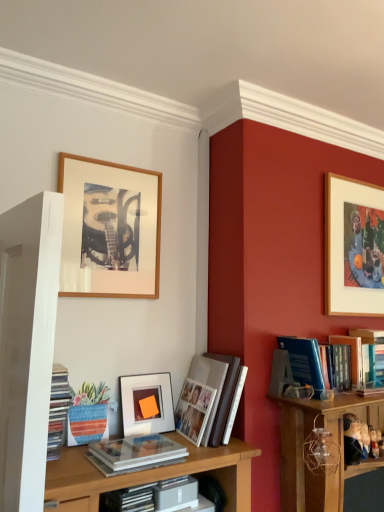
This screenshot has height=512, width=384. I want to click on wooden framed artwork at upper right, which ranks as the 3th picture frame in left-to-right order, so click(353, 247).

Describe the element at coordinates (210, 399) in the screenshot. I see `white paper photo album at center, acting as the 3th book starting from the left` at that location.

Image resolution: width=384 pixels, height=512 pixels. I want to click on blue hardcover book at upper right, positioned as the first book in right-to-left order, so click(371, 355).

This screenshot has height=512, width=384. What do you see at coordinates (305, 362) in the screenshot?
I see `blue hardcover book at center-right, which is the 2th book in right-to-left order` at bounding box center [305, 362].

Identify the location of wooden framed artwork at upper right, which is counted as the 1th picture frame, starting from the right. Image resolution: width=384 pixels, height=512 pixels. (353, 247).

Considering the points (291, 352) and (107, 465), which point is in front, point (291, 352) or point (107, 465)?

The point (107, 465) is closer.

Is blue hardcover book at center-right, which ranks as the fourth book in left-to-right order, taller than matte white book at center, which ranks as the 4th book in right-to-left order?

Indeed, blue hardcover book at center-right, which ranks as the fourth book in left-to-right order, has a greater height compared to matte white book at center, which ranks as the 4th book in right-to-left order.

Starting from the blue hardcover book at center-right, which ranks as the fourth book in left-to-right order, which book is the 2nd one to the left? Please provide its 2D coordinates.

[(137, 451)]

Is blue hardcover book at center-right, which is the 2th book in right-to-left order, far from matte white book at center, which ranks as the 4th book in right-to-left order?

No, there isn't a large distance between blue hardcover book at center-right, which is the 2th book in right-to-left order, and matte white book at center, which ranks as the 4th book in right-to-left order.

Is wooden framed artwork at upper right, which is counted as the 1th picture frame, starting from the right, inside or outside of gray matte book at center?

wooden framed artwork at upper right, which is counted as the 1th picture frame, starting from the right, cannot be found inside gray matte book at center.

Looking at this image, does wooden framed artwork at upper right, which is counted as the 1th picture frame, starting from the right, turn towards gray matte book at center?

No, wooden framed artwork at upper right, which is counted as the 1th picture frame, starting from the right, is not aimed at gray matte book at center.

How far apart are wooden framed artwork at upper right, which is counted as the 1th picture frame, starting from the right, and gray matte book at center?

wooden framed artwork at upper right, which is counted as the 1th picture frame, starting from the right, and gray matte book at center are 4.12 feet apart.

Is wooden framed artwork at upper right, which is counted as the 1th picture frame, starting from the right, wider or thinner than gray matte book at center?

wooden framed artwork at upper right, which is counted as the 1th picture frame, starting from the right, is thinner than gray matte book at center.

Considering their positions, is wooden frame at upper left, positioned as the first picture frame in left-to-right order, located in front of or behind matte glass picture frame at center, which appears as the 2th picture frame when viewed from the right?

wooden frame at upper left, positioned as the first picture frame in left-to-right order, is positioned closer to the viewer than matte glass picture frame at center, which appears as the 2th picture frame when viewed from the right.

From the picture: Considering the positions of objects wooden frame at upper left, positioned as the first picture frame in left-to-right order, and matte glass picture frame at center, which appears as the 2th picture frame when viewed from the right, in the image provided, who is more to the left, wooden frame at upper left, positioned as the first picture frame in left-to-right order, or matte glass picture frame at center, which appears as the 2th picture frame when viewed from the right,?

wooden frame at upper left, positioned as the first picture frame in left-to-right order.

Considering the points (77, 226) and (135, 410), which point is behind, point (77, 226) or point (135, 410)?

Point (135, 410)

Can you tell me how much wooden frame at upper left, positioned as the first picture frame in left-to-right order, and matte glass picture frame at center, marked as the second picture frame in a left-to-right arrangement, differ in facing direction?

The angular difference between wooden frame at upper left, positioned as the first picture frame in left-to-right order, and matte glass picture frame at center, marked as the second picture frame in a left-to-right arrangement, is 0.299 degrees.

Is point (356, 250) farther from camera compared to point (63, 400)?

Yes, it is behind point (63, 400).

From the wooden framed artwork at upper right, which ranks as the 3th picture frame in left-to-right order, count 4th books forward and point to it. Please provide its 2D coordinates.

[(58, 410)]

Considering the relative sizes of wooden framed artwork at upper right, which ranks as the 3th picture frame in left-to-right order, and matte plastic books at left, marked as the first book in a left-to-right arrangement, in the image provided, is wooden framed artwork at upper right, which ranks as the 3th picture frame in left-to-right order, taller than matte plastic books at left, marked as the first book in a left-to-right arrangement,?

Yes, wooden framed artwork at upper right, which ranks as the 3th picture frame in left-to-right order, is taller than matte plastic books at left, marked as the first book in a left-to-right arrangement.

From a real-world perspective, is wooden framed artwork at upper right, which is counted as the 1th picture frame, starting from the right, physically located above or below matte plastic books at left, which ranks as the fifth book in right-to-left order?

wooden framed artwork at upper right, which is counted as the 1th picture frame, starting from the right, is situated higher than matte plastic books at left, which ranks as the fifth book in right-to-left order, in the real world.

Is matte white book at center, which ranks as the 4th book in right-to-left order, far from white paper photo album at center, which is the third book from right to left?

matte white book at center, which ranks as the 4th book in right-to-left order, is near white paper photo album at center, which is the third book from right to left, not far away.

Measure the distance from matte white book at center, which ranks as the 4th book in right-to-left order, to white paper photo album at center, acting as the 3th book starting from the left.

matte white book at center, which ranks as the 4th book in right-to-left order, is 22.87 centimeters away from white paper photo album at center, acting as the 3th book starting from the left.

Relative to white paper photo album at center, acting as the 3th book starting from the left, is matte white book at center, the 2th book when ordered from left to right, in front or behind?

In the image, matte white book at center, the 2th book when ordered from left to right, appears in front of white paper photo album at center, acting as the 3th book starting from the left.

From the image's perspective, is matte white book at center, the 2th book when ordered from left to right, located beneath white paper photo album at center, acting as the 3th book starting from the left?

Yes, from the image's perspective, matte white book at center, the 2th book when ordered from left to right, is beneath white paper photo album at center, acting as the 3th book starting from the left.

Between wooden frame at upper left, the third picture frame in the right-to-left sequence, and matte plastic books at left, which ranks as the fifth book in right-to-left order, which one has larger width?

Wider between the two is matte plastic books at left, which ranks as the fifth book in right-to-left order.

Does wooden frame at upper left, positioned as the first picture frame in left-to-right order, have a smaller size compared to matte plastic books at left, which ranks as the fifth book in right-to-left order?

No, wooden frame at upper left, positioned as the first picture frame in left-to-right order, is not smaller than matte plastic books at left, which ranks as the fifth book in right-to-left order.

Where is `book on the left of wooden frame at upper left, positioned as the first picture frame in left-to-right order`? The height and width of the screenshot is (512, 384). book on the left of wooden frame at upper left, positioned as the first picture frame in left-to-right order is located at coordinates (58, 410).

Can you confirm if wooden frame at upper left, the third picture frame in the right-to-left sequence, is shorter than matte plastic books at left, marked as the first book in a left-to-right arrangement?

In fact, wooden frame at upper left, the third picture frame in the right-to-left sequence, may be taller than matte plastic books at left, marked as the first book in a left-to-right arrangement.

Is wooden framed artwork at upper right, which ranks as the 3th picture frame in left-to-right order, looking in the opposite direction of matte white book at center, which ranks as the 4th book in right-to-left order?

No.

From a real-world perspective, between wooden framed artwork at upper right, which ranks as the 3th picture frame in left-to-right order, and matte white book at center, which ranks as the 4th book in right-to-left order, who is vertically higher?

wooden framed artwork at upper right, which ranks as the 3th picture frame in left-to-right order, is physically above.

From the image's perspective, is wooden framed artwork at upper right, which ranks as the 3th picture frame in left-to-right order, positioned above or below matte white book at center, which ranks as the 4th book in right-to-left order?

Based on their image positions, wooden framed artwork at upper right, which ranks as the 3th picture frame in left-to-right order, is located above matte white book at center, which ranks as the 4th book in right-to-left order.

From the matte white book at center, the 2th book when ordered from left to right, count 3rd books backward and point to it. Please provide its 2D coordinates.

[(305, 362)]

The width and height of the screenshot is (384, 512). Find the location of `paperback book on the left of the wooden framed artwork at upper right, which ranks as the 3th picture frame in left-to-right order`. paperback book on the left of the wooden framed artwork at upper right, which ranks as the 3th picture frame in left-to-right order is located at coordinates pyautogui.click(x=175, y=494).

Considering their positions, is white paper photo album at center, acting as the 3th book starting from the left, positioned further to gray matte book at center than matte white book at center, which ranks as the 4th book in right-to-left order?

white paper photo album at center, acting as the 3th book starting from the left, lies further to gray matte book at center than the other object.

From the image, which object appears to be nearer to blue hardcover book at center-right, which is the 2th book in right-to-left order, wooden framed artwork at upper right, which is counted as the 1th picture frame, starting from the right, or white paper photo album at center, acting as the 3th book starting from the left?

Based on the image, white paper photo album at center, acting as the 3th book starting from the left, appears to be nearer to blue hardcover book at center-right, which is the 2th book in right-to-left order.

Looking at the image, which one is located closer to matte plastic books at left, which ranks as the fifth book in right-to-left order, white paper photo album at center, acting as the 3th book starting from the left, or matte white book at center, which ranks as the 4th book in right-to-left order?

matte white book at center, which ranks as the 4th book in right-to-left order, is closer to matte plastic books at left, which ranks as the fifth book in right-to-left order.

When comparing their distances from blue hardcover book at center-right, which is the 2th book in right-to-left order, does matte glass picture frame at center, marked as the second picture frame in a left-to-right arrangement, or wooden frame at upper left, positioned as the first picture frame in left-to-right order, seem closer?

The object closer to blue hardcover book at center-right, which is the 2th book in right-to-left order, is matte glass picture frame at center, marked as the second picture frame in a left-to-right arrangement.

Estimate the real-world distances between objects in this image. Which object is further from matte glass picture frame at center, marked as the second picture frame in a left-to-right arrangement, gray matte book at center or wooden framed artwork at upper right, which ranks as the 3th picture frame in left-to-right order?

wooden framed artwork at upper right, which ranks as the 3th picture frame in left-to-right order.

When comparing their distances from blue hardcover book at center-right, which is the 2th book in right-to-left order, does matte glass picture frame at center, which appears as the 2th picture frame when viewed from the right, or matte plastic books at left, which ranks as the fifth book in right-to-left order, seem further?

Among the two, matte plastic books at left, which ranks as the fifth book in right-to-left order, is located further to blue hardcover book at center-right, which is the 2th book in right-to-left order.

When comparing their distances from white paper photo album at center, which is the third book from right to left, does gray matte book at center or blue hardcover book at center-right, which ranks as the fourth book in left-to-right order, seem closer?

gray matte book at center.

Based on their spatial positions, is matte plastic books at left, which ranks as the fifth book in right-to-left order, or wooden frame at upper left, positioned as the first picture frame in left-to-right order, closer to matte white book at center, the 2th book when ordered from left to right?

The object closer to matte white book at center, the 2th book when ordered from left to right, is matte plastic books at left, which ranks as the fifth book in right-to-left order.

Find the location of `paperback book between matte plastic books at left, which ranks as the fifth book in right-to-left order, and blue hardcover book at upper right, marked as the fifth book in a left-to-right arrangement, in the horizontal direction`. paperback book between matte plastic books at left, which ranks as the fifth book in right-to-left order, and blue hardcover book at upper right, marked as the fifth book in a left-to-right arrangement, in the horizontal direction is located at coordinates (175, 494).

Find the location of a particular element. paperback book between wooden frame at upper left, positioned as the first picture frame in left-to-right order, and blue hardcover book at upper right, positioned as the first book in right-to-left order, in the horizontal direction is located at coordinates (175, 494).

Image resolution: width=384 pixels, height=512 pixels. I want to click on book situated between white paper photo album at center, acting as the 3th book starting from the left, and wooden framed artwork at upper right, which is counted as the 1th picture frame, starting from the right, from left to right, so click(x=305, y=362).

At what (x,y) coordinates should I click in order to perform the action: click on book between matte white book at center, which ranks as the 4th book in right-to-left order, and blue hardcover book at center-right, which is the 2th book in right-to-left order. Please return your answer as a coordinate pair (x, y). This screenshot has height=512, width=384. Looking at the image, I should click on (210, 399).